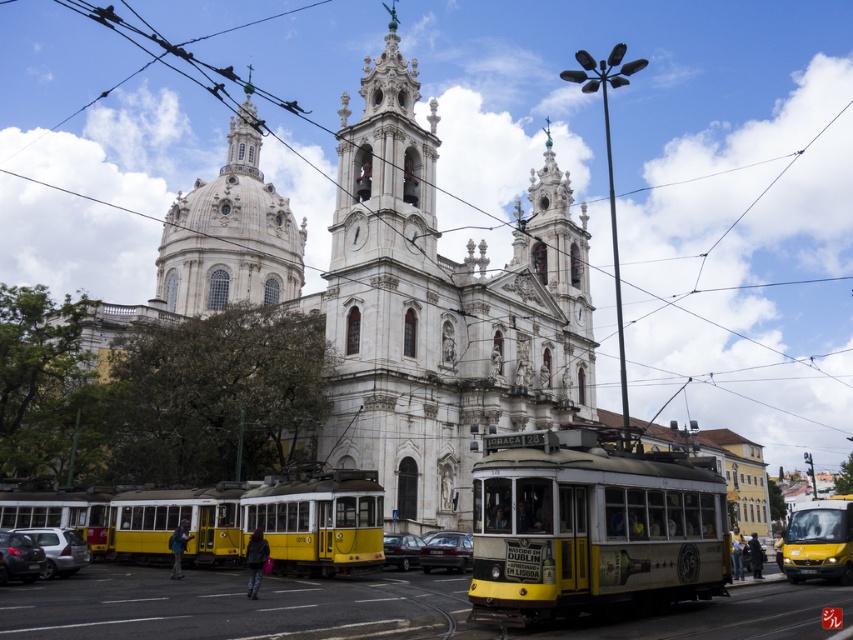
Based on the photo, what is the coordinate of the white marble church at center?

The white marble church at center is located at coordinate point [399,296].

You are a tourist in Lisbon and want to take a photo of the grand church in the background. You have a camera with a limited zoom lens. You need to position yourself so that both the silver metallic car at lower left and the dark gray matte car at center are fully visible in the frame. Which car should you stand closer to to ensure both are in the shot?

You should stand closer to the silver metallic car at lower left because it is smaller than the dark gray matte car at center. By positioning yourself nearer to the smaller car, you can include both cars within the camera frame while maintaining their visibility.